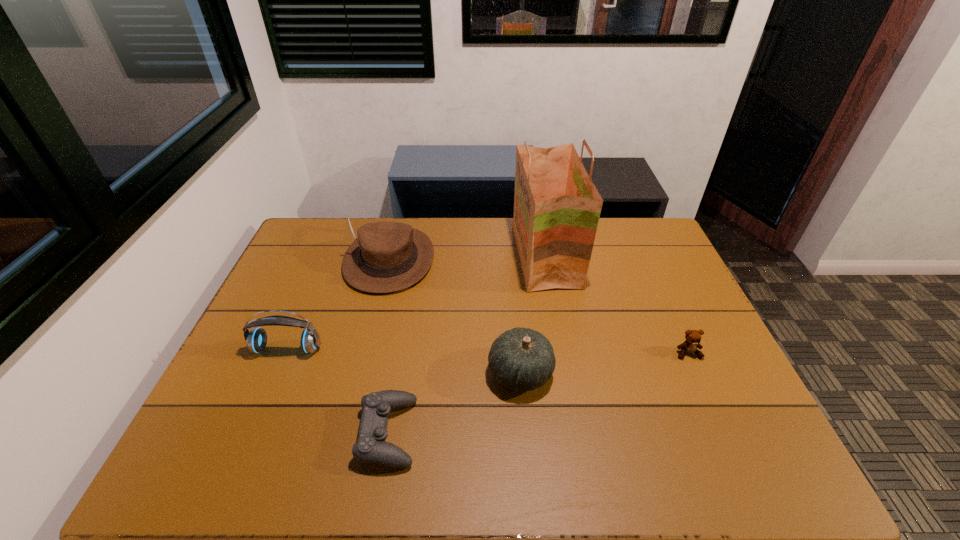
Locate an element on the screen. This screenshot has width=960, height=540. free point at the right edge is located at coordinates (633, 273).

In the image, there is a desktop. At what (x,y) coordinates should I click in order to perform the action: click on vacant space at the far left corner. Please return your answer as a coordinate pair (x, y). Looking at the image, I should click on (348, 219).

Find the location of a particular element. This screenshot has height=540, width=960. free space between the fedora and the control is located at coordinates (389, 346).

Find the location of a particular element. unoccupied area between the headset and the grocery bag is located at coordinates (417, 303).

At what (x,y) coordinates should I click in order to perform the action: click on empty location between the shortest object and the tallest object. Please return your answer as a coordinate pair (x, y). The image size is (960, 540). Looking at the image, I should click on (467, 345).

In order to click on free space between the fedora and the tallest object in this screenshot , I will do click(x=468, y=258).

Identify the location of unoccupied area between the fifth tallest object and the fedora. Image resolution: width=960 pixels, height=540 pixels. pos(539,306).

Identify the location of vacant point located between the rightmost object and the grocery bag. This screenshot has width=960, height=540. (616, 305).

What are the coordinates of `unoccupied area between the shortest object and the gourd` in the screenshot? It's located at (454, 402).

The image size is (960, 540). I want to click on unoccupied position between the rightmost object and the gourd, so click(604, 363).